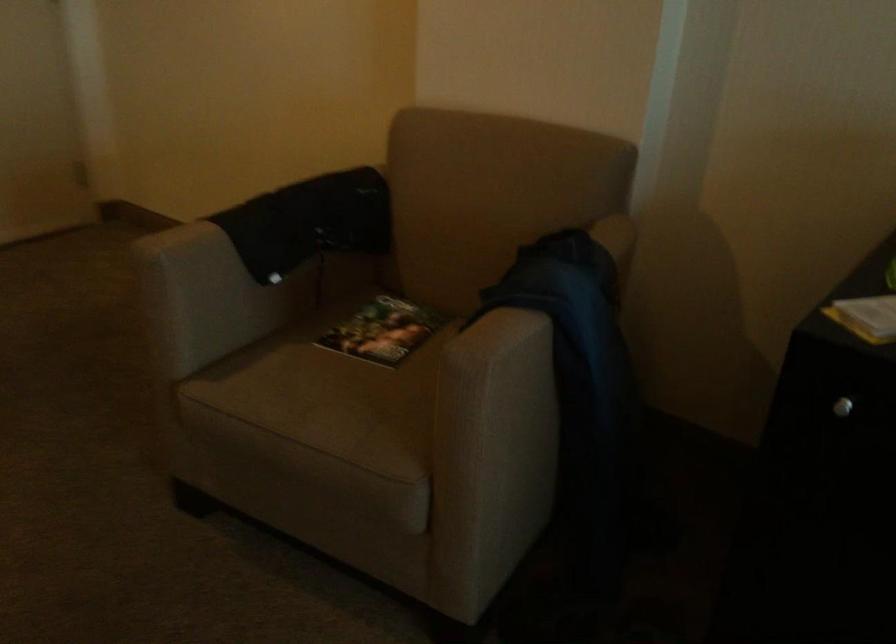
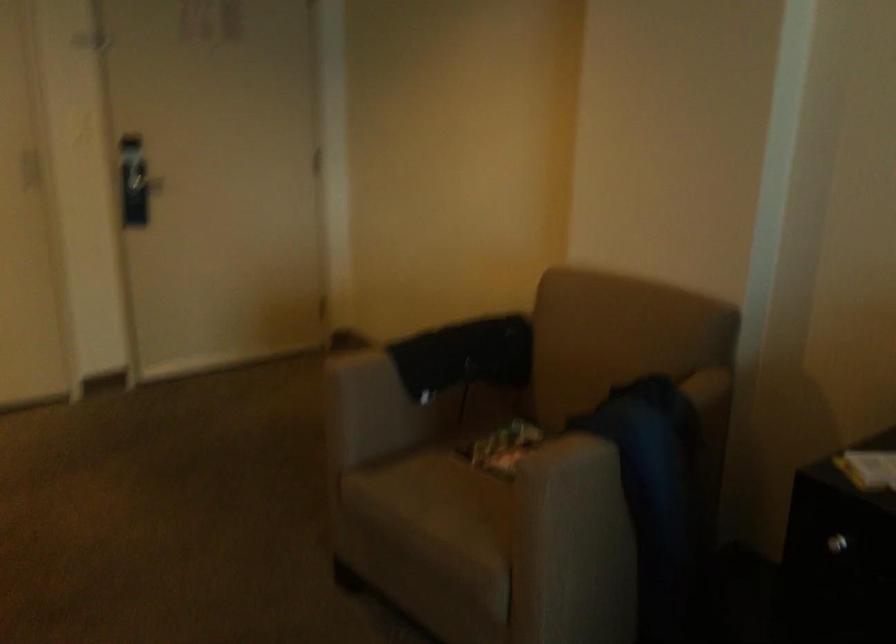
Which direction would the cameraman need to move to produce the second image?

The cameraman walked toward right, backward.